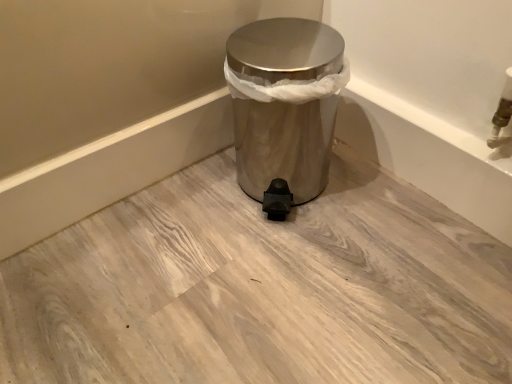
This screenshot has width=512, height=384. In order to click on free space below polished stainless steel trash can at center (from a real-world perspective) in this screenshot , I will do `click(296, 185)`.